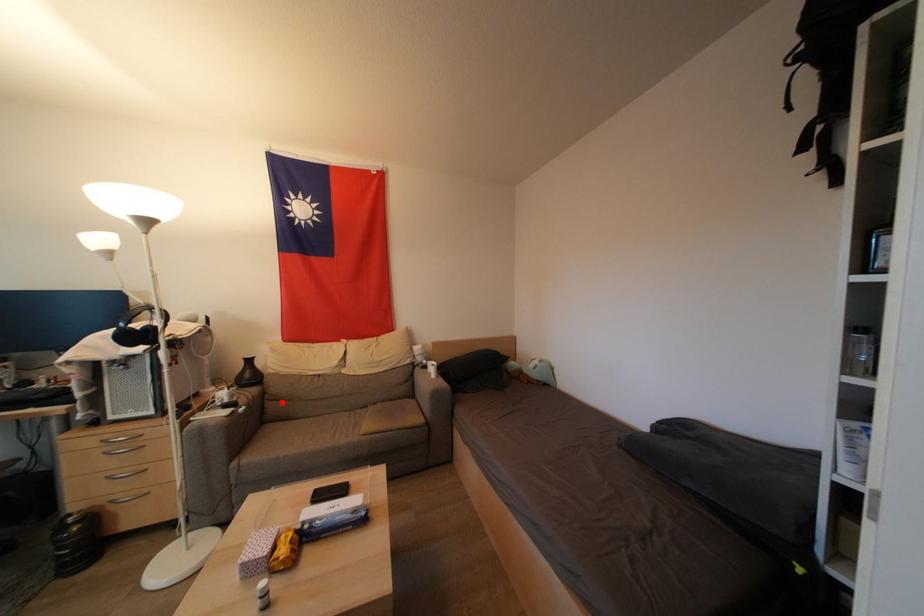
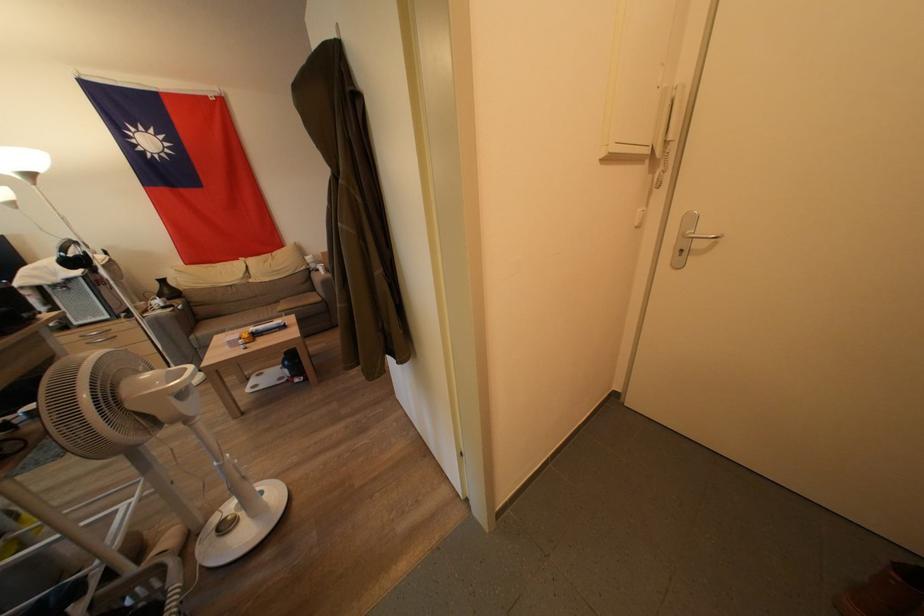
In the second image, find the point that corresponds to the highlighted location in the first image.

(207, 309)